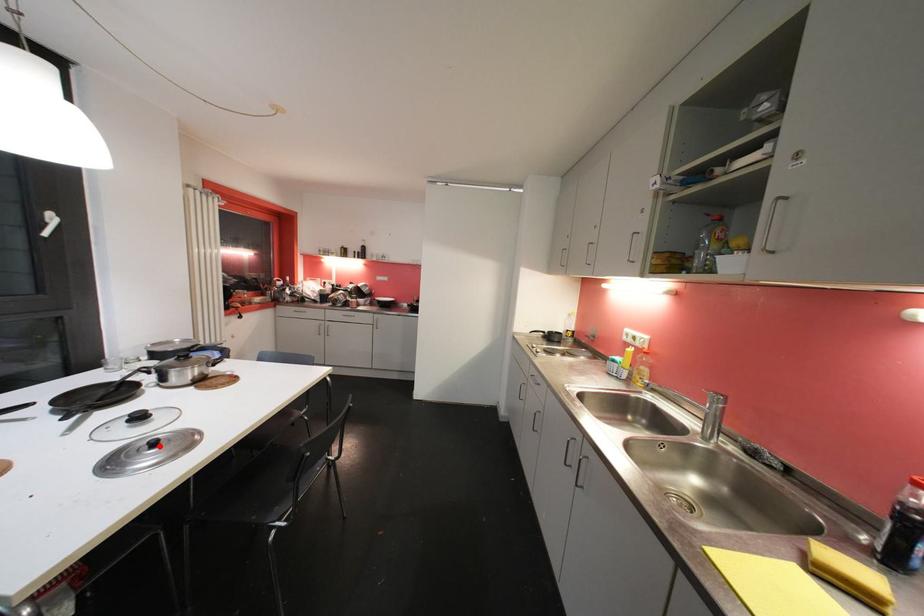
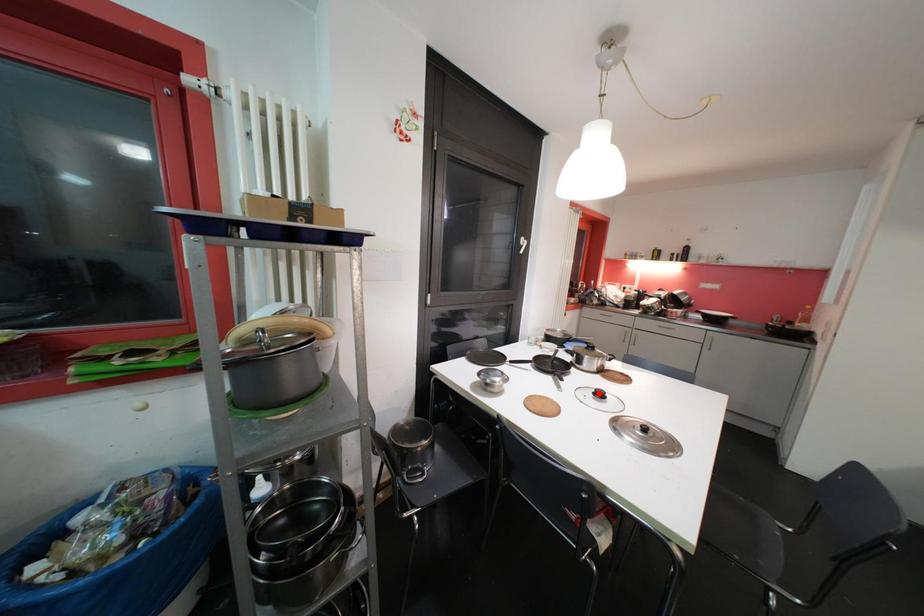
I am providing you with two images of the same scene from different viewpoints. A red point is marked on the first image and another point is marked on the second image. Is the red point in image1 aligned with the point shown in image2?

No